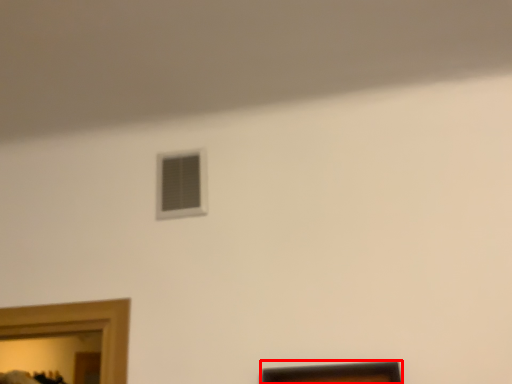
Question: Observing the image, what is the correct spatial positioning of picture frame (annotated by the red box) in reference to window?

Choices:
 (A) right
 (B) left

Answer: (A)